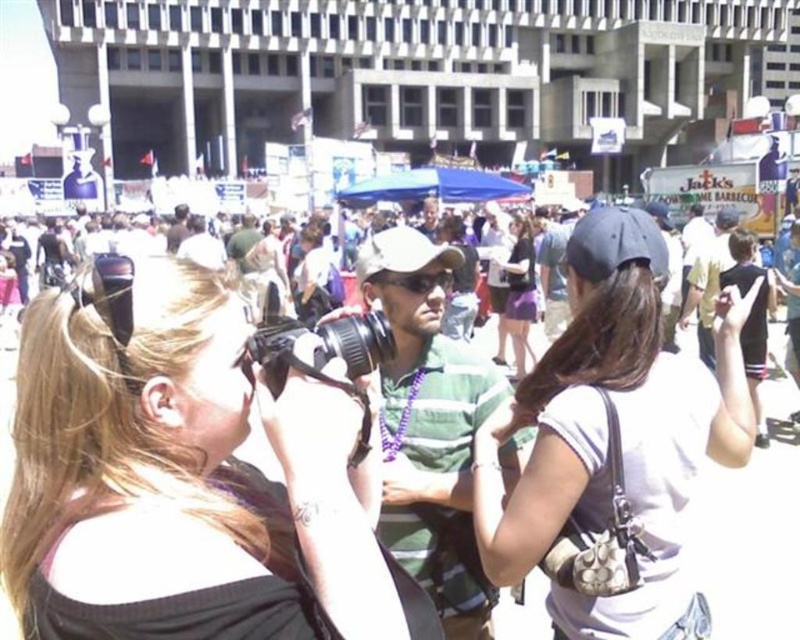
Is purple matte skirt at center positioned before white matte baseball cap at center?

That is False.

Is purple matte skirt at center below white matte baseball cap at center?

Answer: Yes, purple matte skirt at center is below white matte baseball cap at center.

Is point (514, 232) more distant than point (362, 276)?

Yes, point (514, 232) is behind point (362, 276).

What are the coordinates of `purple matte skirt at center` in the screenshot? It's located at (518, 296).

Is white matte purse at center below matte black camera at center?

Yes, white matte purse at center is below matte black camera at center.

Based on the photo, is white matte purse at center shorter than matte black camera at center?

No, white matte purse at center is not shorter than matte black camera at center.

This screenshot has width=800, height=640. Describe the element at coordinates (616, 444) in the screenshot. I see `white matte purse at center` at that location.

At what (x,y) coordinates should I click in order to perform the action: click on white matte purse at center. Please return your answer as a coordinate pair (x, y). Looking at the image, I should click on (616, 444).

Can you confirm if white matte baseball cap at center is thinner than matte black camera at center?

Yes.

Can you confirm if white matte baseball cap at center is positioned to the left of matte black camera at center?

In fact, white matte baseball cap at center is to the right of matte black camera at center.

Between point (396, 259) and point (404, 468), which one is positioned in front?

Point (404, 468) is in front.

The width and height of the screenshot is (800, 640). I want to click on white matte baseball cap at center, so click(x=402, y=252).